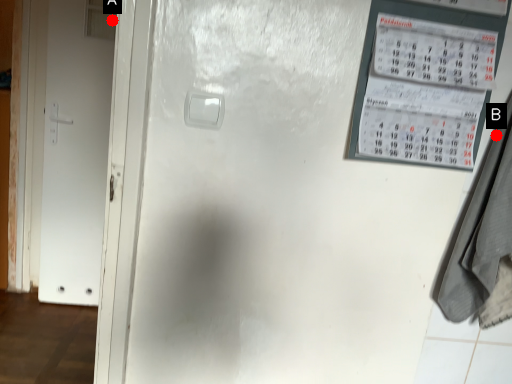
Question: Two points are circled on the image, labeled by A and B beside each circle. Which point is further to the camera?

Choices:
 (A) A is further
 (B) B is further

Answer: (A)